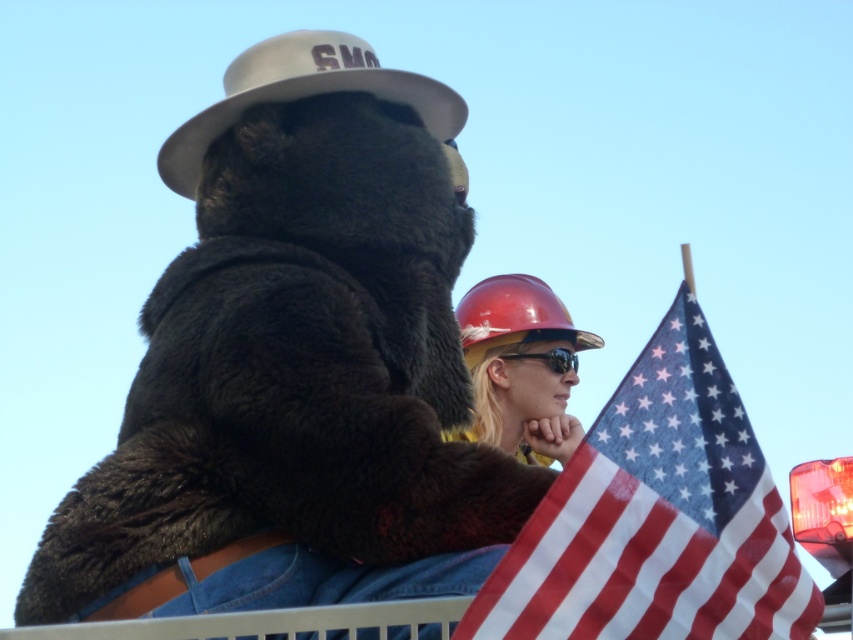
Question: Which point is farther to the camera?

Choices:
 (A) american flag at center
 (B) hard hat at upper center
 (C) black plastic goggles at center
 (D) red hard hat at center

Answer: (C)

Question: Is white matte hat at upper center bigger than red hard hat at center?

Choices:
 (A) no
 (B) yes

Answer: (B)

Question: Where is hard hat at upper center located in relation to white matte hat at upper center in the image?

Choices:
 (A) right
 (B) left

Answer: (A)

Question: Which of the following is the farthest from the observer?

Choices:
 (A) (202, 220)
 (B) (561, 349)
 (C) (720, 385)
 (D) (519, 273)

Answer: (D)

Question: Which object is closer to the camera taking this photo?

Choices:
 (A) black plastic goggles at center
 (B) american flag at center

Answer: (B)

Question: Does american flag at center appear on the right side of white matte hat at upper center?

Choices:
 (A) no
 (B) yes

Answer: (B)